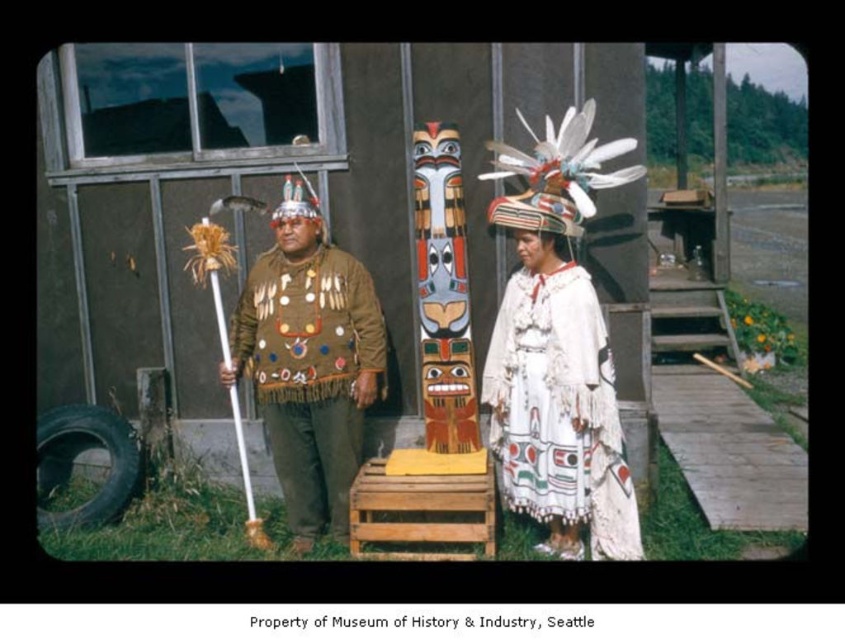
Question: Is white fringed dress at center thinner than brown leather jacket at center?

Choices:
 (A) yes
 (B) no

Answer: (A)

Question: Can you confirm if brown leather jacket at center is positioned above polychrome carved totem pole at center?

Choices:
 (A) no
 (B) yes

Answer: (A)

Question: Which point appears farthest from the camera in this image?

Choices:
 (A) (458, 419)
 (B) (604, 509)
 (C) (281, 358)

Answer: (A)

Question: Which point is farther from the camera taking this photo?

Choices:
 (A) (578, 365)
 (B) (284, 321)

Answer: (B)

Question: Is brown leather jacket at center in front of polychrome carved totem pole at center?

Choices:
 (A) no
 (B) yes

Answer: (B)

Question: Which of the following is the closest to the observer?

Choices:
 (A) polychrome carved totem pole at center
 (B) white fringed dress at center
 (C) brown leather jacket at center

Answer: (B)